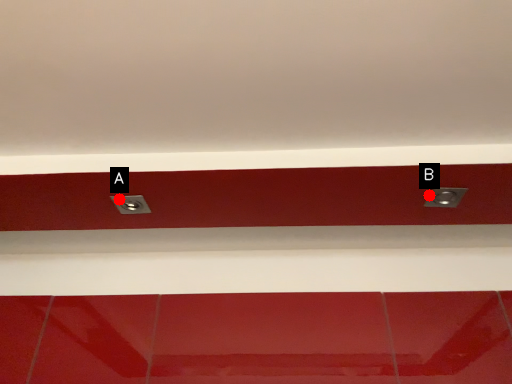
Question: Two points are circled on the image, labeled by A and B beside each circle. Among these points, which one is nearest to the camera?

Choices:
 (A) A is closer
 (B) B is closer

Answer: (B)